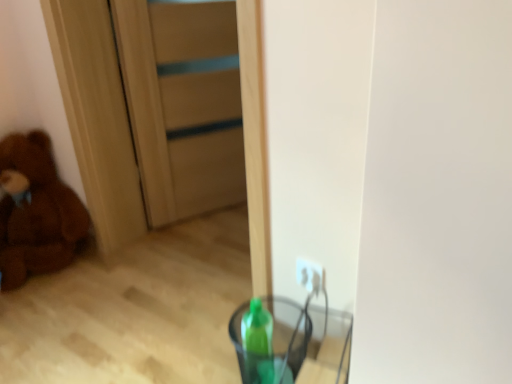
Measure the distance between point (291, 305) and camera.

Point (291, 305) is 1.38 meters from camera.

Image resolution: width=512 pixels, height=384 pixels. Find the location of `wooden door at center`. wooden door at center is located at coordinates (183, 104).

Find the location of a particular element. brown plush teddy bear at left is located at coordinates (35, 211).

Is point (132, 61) positioned after point (23, 185)?

No, it is not.

Considering the relative positions of wooden door at center and brown plush teddy bear at left in the image provided, is wooden door at center to the left or to the right of brown plush teddy bear at left?

wooden door at center is positioned on brown plush teddy bear at left's right side.

Where is `teddy bear below the wooden door at center (from a real-world perspective)`? The height and width of the screenshot is (384, 512). teddy bear below the wooden door at center (from a real-world perspective) is located at coordinates (35, 211).

Which of these two, wooden door at center or brown plush teddy bear at left, stands taller?

wooden door at center.

From the image's perspective, is wooden door at center located beneath transparent plastic cup at lower center?

No, from the image's perspective, wooden door at center is not beneath transparent plastic cup at lower center.

Considering the positions of point (229, 127) and point (298, 349), is point (229, 127) closer or farther from the camera than point (298, 349)?

Point (229, 127).

Looking at their sizes, would you say wooden door at center is wider or thinner than transparent plastic cup at lower center?

In the image, wooden door at center appears to be more narrow than transparent plastic cup at lower center.

Is wooden door at center bigger or smaller than transparent plastic cup at lower center?

wooden door at center is bigger than transparent plastic cup at lower center.

Can you confirm if brown plush teddy bear at left is positioned to the right of wooden door at center?

No.

Is brown plush teddy bear at left closer to the viewer compared to wooden door at center?

Yes, the depth of brown plush teddy bear at left is less than that of wooden door at center.

You are a GUI agent. You are given a task and a screenshot of the screen. Output one action in this format:
    pyautogui.click(x=<x>, y=<y>)
    Task: Click on the teddy bear that appears below the wooden door at center (from the image's perspective)
    The image size is (512, 384).
    Given the screenshot: What is the action you would take?
    pyautogui.click(x=35, y=211)

Between brown plush teddy bear at left and transparent plastic cup at lower center, which one has smaller size?

transparent plastic cup at lower center is smaller.

Can you confirm if brown plush teddy bear at left is taller than transparent plastic cup at lower center?

Yes.

Can you confirm if brown plush teddy bear at left is thinner than transparent plastic cup at lower center?

No, brown plush teddy bear at left is not thinner than transparent plastic cup at lower center.

Can you confirm if brown plush teddy bear at left is positioned to the left of transparent plastic cup at lower center?

Correct, you'll find brown plush teddy bear at left to the left of transparent plastic cup at lower center.

Based on the photo, is transparent plastic cup at lower center oriented towards wooden door at center?

No, transparent plastic cup at lower center is not oriented towards wooden door at center.

Is wooden door at center a part of transparent plastic cup at lower center?

No, wooden door at center is located outside of transparent plastic cup at lower center.

Which of these two, transparent plastic cup at lower center or wooden door at center, stands taller?

With more height is wooden door at center.

From the image's perspective, is transparent plastic cup at lower center located beneath wooden door at center?

Yes, from the image's perspective, transparent plastic cup at lower center is below wooden door at center.

Considering the relative sizes of transparent plastic cup at lower center and brown plush teddy bear at left in the image provided, is transparent plastic cup at lower center shorter than brown plush teddy bear at left?

Indeed, transparent plastic cup at lower center has a lesser height compared to brown plush teddy bear at left.

From the image's perspective, is transparent plastic cup at lower center on top of brown plush teddy bear at left?

No.

Measure the distance from transparent plastic cup at lower center to brown plush teddy bear at left.

A distance of 1.04 meters exists between transparent plastic cup at lower center and brown plush teddy bear at left.

Which is in front, point (242, 314) or point (18, 256)?

The point (242, 314) is in front.

This screenshot has height=384, width=512. In the image, there is a wooden door at center. In order to click on teddy bear below it (from a real-world perspective) in this screenshot , I will do `click(35, 211)`.

The height and width of the screenshot is (384, 512). I want to click on glass vase on the right of the wooden door at center, so pyautogui.click(x=273, y=342).

Which object lies nearer to the anchor point transparent plastic cup at lower center, wooden door at center or brown plush teddy bear at left?

wooden door at center is closer to transparent plastic cup at lower center.

From the image, which object appears to be farther from transparent plastic cup at lower center, brown plush teddy bear at left or wooden door at center?

Based on the image, brown plush teddy bear at left appears to be further to transparent plastic cup at lower center.

Looking at this image, considering their positions, is brown plush teddy bear at left positioned closer to wooden door at center than transparent plastic cup at lower center?

Based on the image, brown plush teddy bear at left appears to be nearer to wooden door at center.

Considering their positions, is transparent plastic cup at lower center positioned closer to wooden door at center than brown plush teddy bear at left?

brown plush teddy bear at left lies closer to wooden door at center than the other object.

Considering their positions, is transparent plastic cup at lower center positioned further to brown plush teddy bear at left than wooden door at center?

transparent plastic cup at lower center is further to brown plush teddy bear at left.

Considering their positions, is wooden door at center positioned further to brown plush teddy bear at left than transparent plastic cup at lower center?

Based on the image, transparent plastic cup at lower center appears to be further to brown plush teddy bear at left.

Identify the location of door located between brown plush teddy bear at left and transparent plastic cup at lower center in the left-right direction. (183, 104).